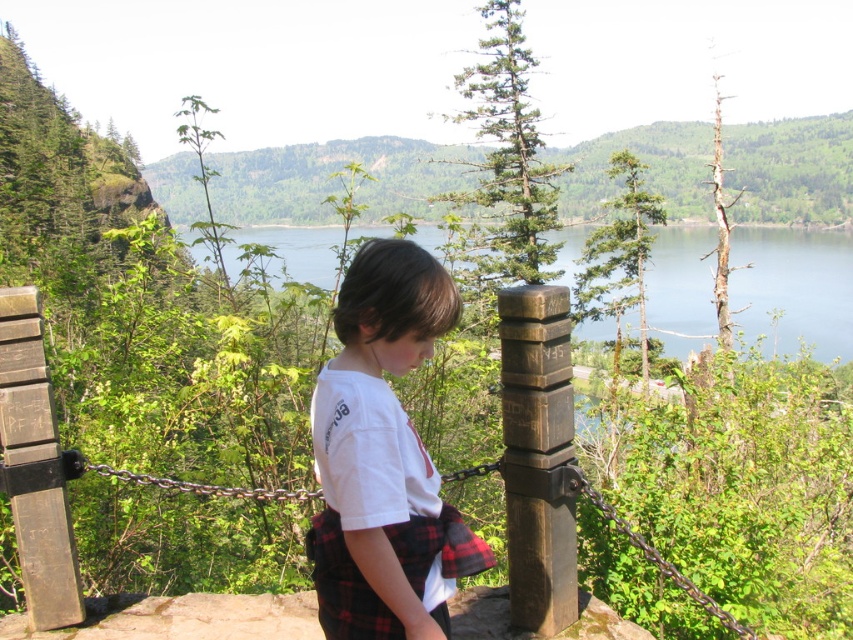
Does greenish-blue water at center have a lesser width compared to brown wood post at center?

No, greenish-blue water at center is not thinner than brown wood post at center.

Does point (712, 310) come farther from viewer compared to point (529, 584)?

That is True.

Find the location of a particular element. This screenshot has width=853, height=640. greenish-blue water at center is located at coordinates (793, 289).

Does white cotton shirt at center appear over brown wood post at center?

Yes.

Based on the photo, is white cotton shirt at center below brown wood post at center?

Incorrect, white cotton shirt at center is not positioned below brown wood post at center.

Describe the element at coordinates (384, 458) in the screenshot. I see `white cotton shirt at center` at that location.

At what (x,y) coordinates should I click in order to perform the action: click on white cotton shirt at center. Please return your answer as a coordinate pair (x, y). The width and height of the screenshot is (853, 640). Looking at the image, I should click on (384, 458).

The image size is (853, 640). Describe the element at coordinates (384, 458) in the screenshot. I see `white cotton shirt at center` at that location.

Does white cotton shirt at center lie behind greenish-blue water at center?

That is False.

Who is more distant from viewer, (347, 403) or (741, 314)?

Result: The point (741, 314) is behind.

Find the location of `white cotton shirt at center`. white cotton shirt at center is located at coordinates (384, 458).